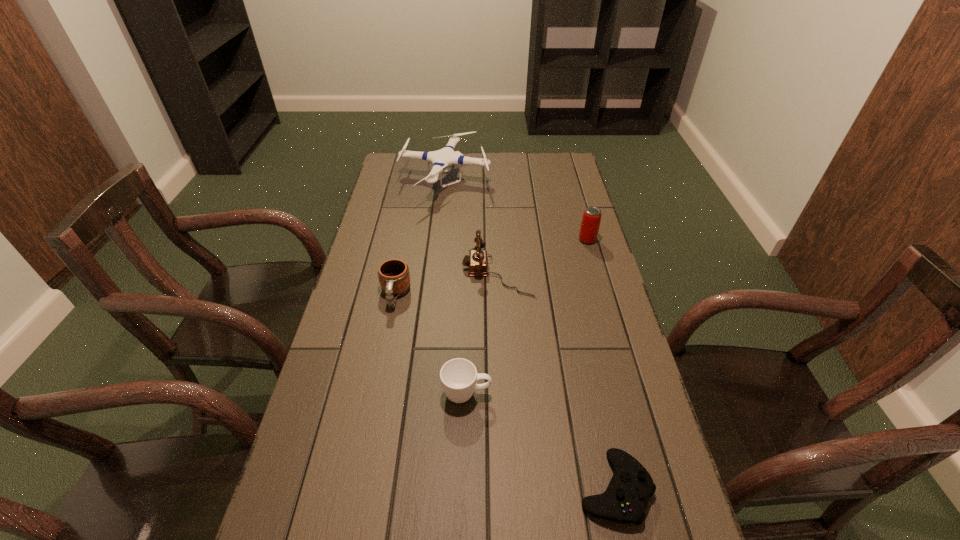
At what (x,y) coordinates should I click in order to perform the action: click on drone. Please return your answer as a coordinate pair (x, y). The image size is (960, 540). Looking at the image, I should click on (440, 159).

Locate an element on the screen. beer can is located at coordinates (591, 219).

Where is `the fourth shortest object`? The image size is (960, 540). the fourth shortest object is located at coordinates (477, 262).

Where is `cup`? cup is located at coordinates (458, 376).

Identify the location of mug. The height and width of the screenshot is (540, 960). (394, 277).

You are a GUI agent. You are given a task and a screenshot of the screen. Output one action in this format:
    pyautogui.click(x=<x>, y=<y>)
    Task: Click on the nearest object
    The height and width of the screenshot is (540, 960).
    Given the screenshot: What is the action you would take?
    pyautogui.click(x=624, y=501)

This screenshot has width=960, height=540. I want to click on control, so click(624, 501).

In order to click on free spot located 0.120m on the right of the drone in this screenshot , I will do `click(519, 183)`.

Identify the location of vacant space located on the back of the beer can. The width and height of the screenshot is (960, 540). (574, 194).

The width and height of the screenshot is (960, 540). I want to click on vacant space situated 0.300m on the dial of the third tallest object, so (x=370, y=273).